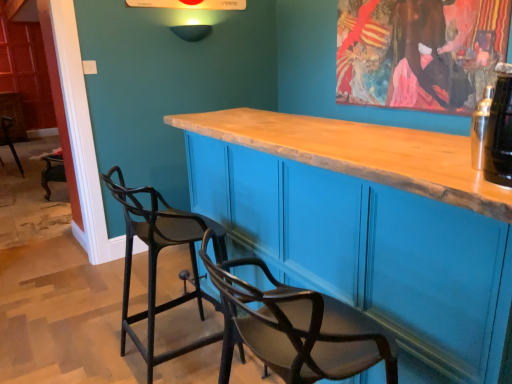
Question: Relative to black matte chair at left, the second chair viewed from the left, is black matte chair at left, the first chair in the left-to-right sequence, in front or behind?

Choices:
 (A) front
 (B) behind

Answer: (B)

Question: In the image, is black matte chair at left, which is counted as the 1th chair, starting from the back, on the left side or the right side of black matte chair at left, the second chair viewed from the left?

Choices:
 (A) left
 (B) right

Answer: (A)

Question: Considering the real-world distances, which object is closest to the black matte chair at left, the first chair in the left-to-right sequence?

Choices:
 (A) wooden cabinet at center
 (B) black glass bottle at upper right
 (C) black matte chair at left, acting as the 2th chair starting from the top

Answer: (C)

Question: Based on their relative distances, which object is nearer to the black matte chair at left, which is the 2th chair in right-to-left order?

Choices:
 (A) black glass bottle at upper right
 (B) black matte chair at left, positioned as the first chair in right-to-left order
 (C) wooden cabinet at center

Answer: (B)